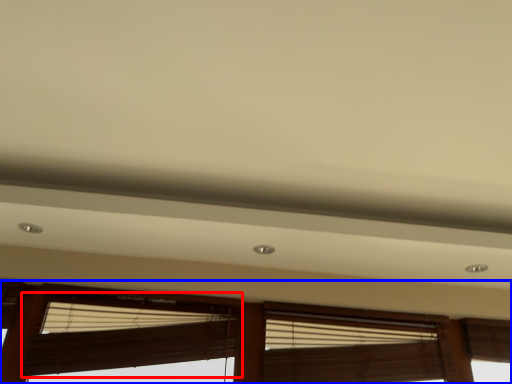
Question: Which object appears farthest to the camera in this image, window blind (highlighted by a red box) or window (highlighted by a blue box)?

Choices:
 (A) window blind
 (B) window

Answer: (A)